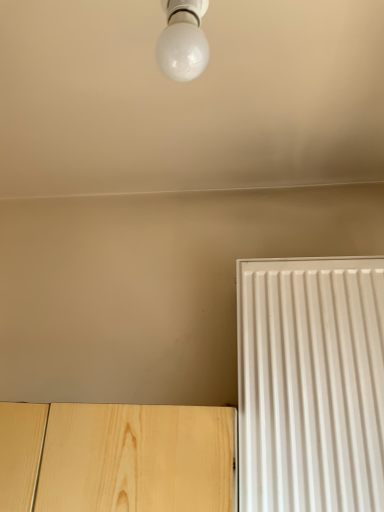
At what (x,y) coordinates should I click in order to perform the action: click on white plastic radiator at lower right. Please return your answer as a coordinate pair (x, y). Looking at the image, I should click on [x=311, y=384].

This screenshot has height=512, width=384. Describe the element at coordinates (311, 384) in the screenshot. I see `white plastic radiator at lower right` at that location.

At what (x,y) coordinates should I click in order to perform the action: click on white plastic radiator at lower right. Please return your answer as a coordinate pair (x, y). Looking at the image, I should click on (311, 384).